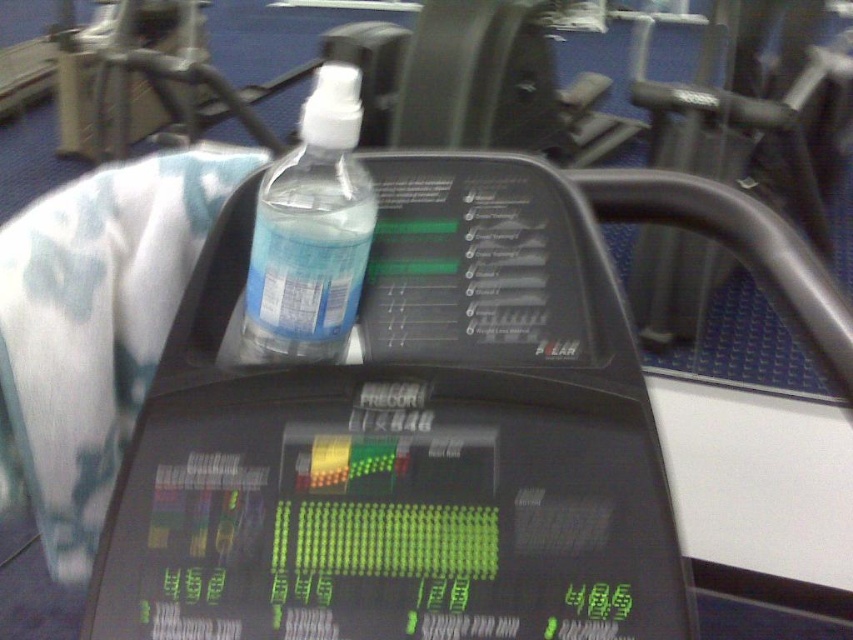
Question: Among these points, which one is farthest from the camera?

Choices:
 (A) (228, 529)
 (B) (276, 305)

Answer: (B)

Question: Is transparent plastic bottle at upper center positioned at the back of transparent plastic bottle at center?

Choices:
 (A) yes
 (B) no

Answer: (B)

Question: Considering the relative positions of transparent plastic bottle at upper center and transparent plastic bottle at center in the image provided, where is transparent plastic bottle at upper center located with respect to transparent plastic bottle at center?

Choices:
 (A) left
 (B) right

Answer: (B)

Question: Among these points, which one is farthest from the camera?

Choices:
 (A) [x=683, y=625]
 (B) [x=251, y=294]

Answer: (B)

Question: Does transparent plastic bottle at upper center have a greater width compared to transparent plastic bottle at center?

Choices:
 (A) no
 (B) yes

Answer: (B)

Question: Which point is farther to the camera?

Choices:
 (A) (247, 289)
 (B) (302, 605)

Answer: (A)